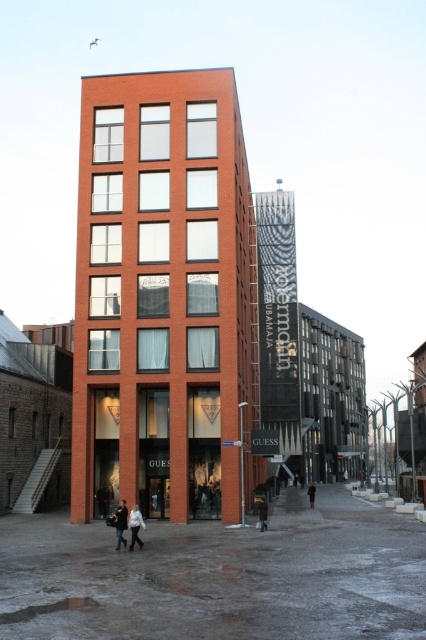
Question: Among these objects, which one is nearest to the camera?

Choices:
 (A) white matte jacket at lower center
 (B) dark brown leather jacket at lower center

Answer: (A)

Question: Which point appears farthest from the camera in this image?

Choices:
 (A) (229, 458)
 (B) (261, 509)

Answer: (A)

Question: Can you confirm if white matte jacket at lower center is positioned to the left of dark brown leather jacket at lower center?

Choices:
 (A) no
 (B) yes

Answer: (B)

Question: Based on their relative distances, which object is nearer to the dark brown leather jacket at lower center?

Choices:
 (A) white cotton jacket at lower center
 (B) white matte jacket at lower center

Answer: (A)

Question: Does dark brown leather jacket at lower center appear under dark brown leather coat at lower center?

Choices:
 (A) no
 (B) yes

Answer: (A)

Question: Can you confirm if white cotton jacket at lower center is positioned below dark brown leather jacket at lower center?

Choices:
 (A) no
 (B) yes

Answer: (A)